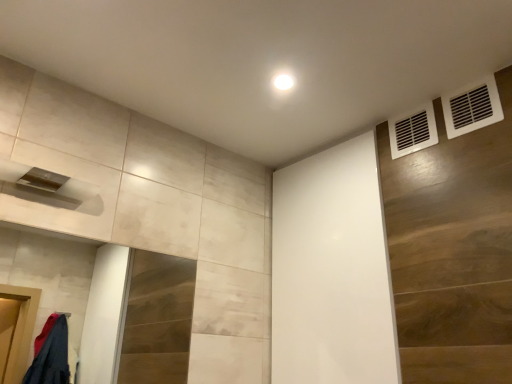
Question: Which is correct: white matte screen door at upper center is inside white plastic vent at upper right, the first air conditioning when ordered from right to left, or outside of it?

Choices:
 (A) inside
 (B) outside

Answer: (B)

Question: From the image's perspective, is white matte screen door at upper center above or below white plastic vent at upper right, the first air conditioning when ordered from right to left?

Choices:
 (A) below
 (B) above

Answer: (A)

Question: Estimate the real-world distances between objects in this image. Which object is farther from the white plastic vent at upper right, the second air conditioning in the front-to-back sequence?

Choices:
 (A) white matte screen door at upper center
 (B) white plastic vent at upper right, acting as the second air conditioning starting from the back

Answer: (A)

Question: Which is farther from the white plastic vent at upper right, the first air conditioning when ordered from front to back?

Choices:
 (A) white plastic vent at upper right, the second air conditioning in the front-to-back sequence
 (B) white matte screen door at upper center

Answer: (B)